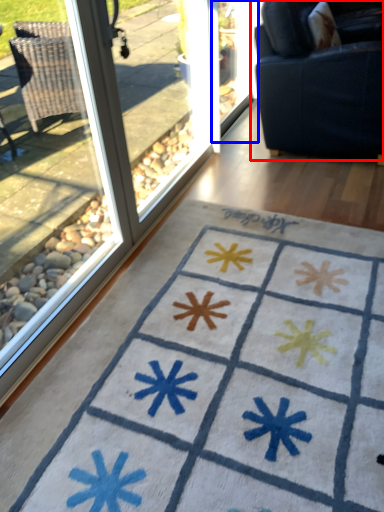
Question: Which point is closer to the camera, studio couch (highlighted by a red box) or screen door (highlighted by a blue box)?

Choices:
 (A) studio couch
 (B) screen door

Answer: (A)